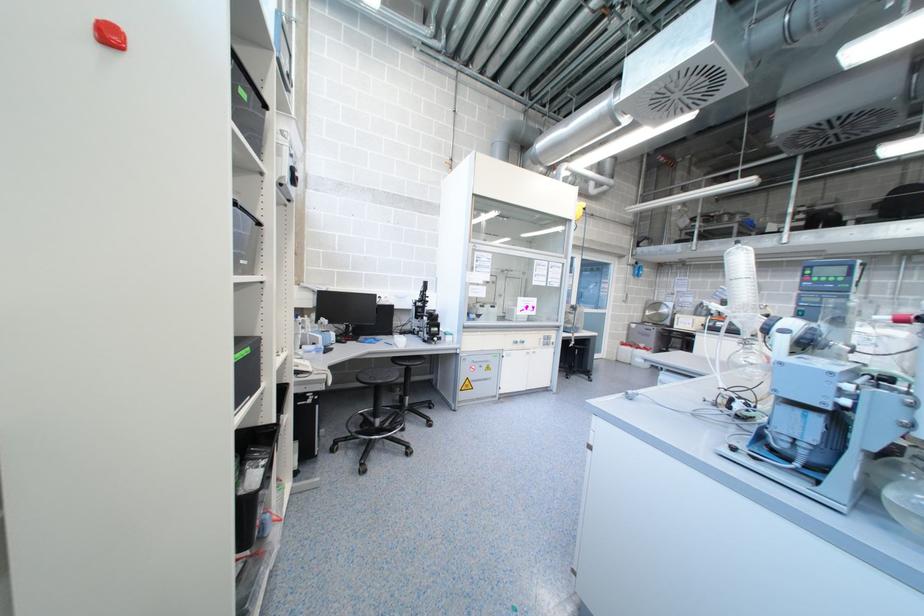
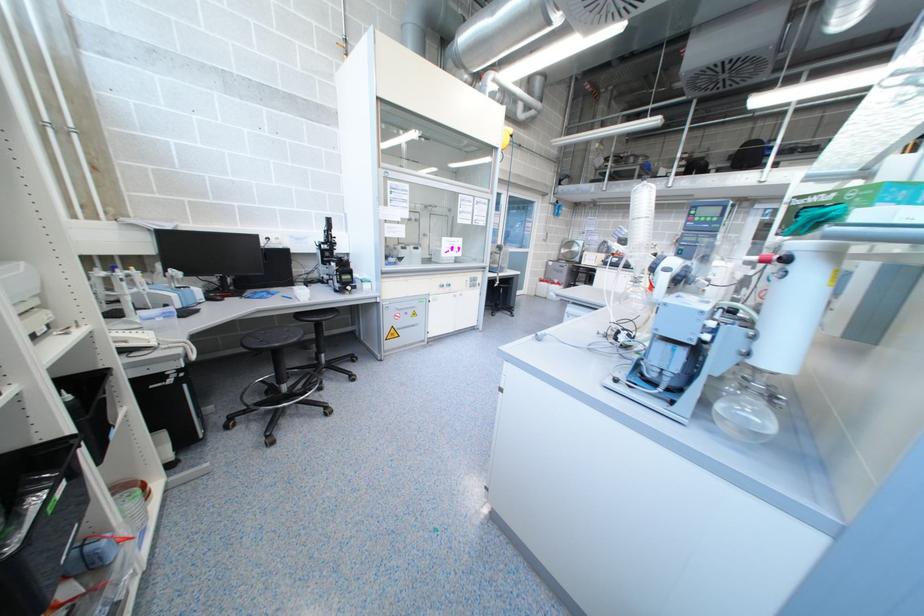
Question: Based on the continuous images, in which direction is the camera rotating? Reply with the corresponding letter.

Choices:
 (A) Left
 (B) Right
 (C) Up
 (D) Down

Answer: (B)